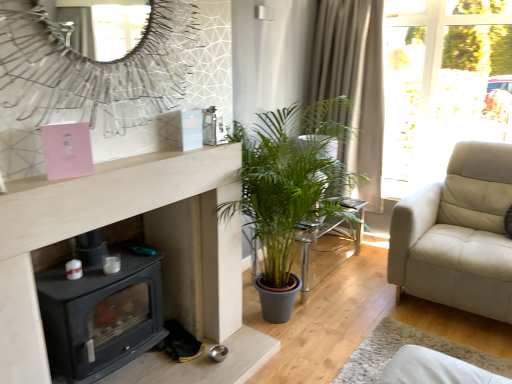
At what (x,y) coordinates should I click in order to perform the action: click on free space in front of translucent glass table at center. Please return your answer as a coordinate pair (x, y). This screenshot has height=384, width=512. Looking at the image, I should click on (354, 320).